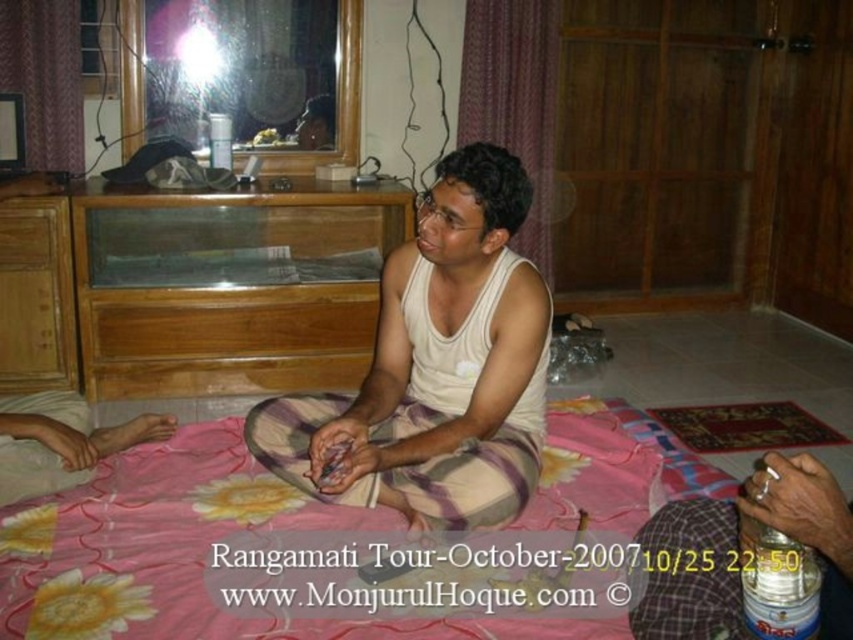
Can you confirm if pink floral blanket at center is shorter than white cotton tank top at center?

Yes.

Can you confirm if pink floral blanket at center is bigger than white cotton tank top at center?

Indeed, pink floral blanket at center has a larger size compared to white cotton tank top at center.

Does point (566, 572) come farther from viewer compared to point (367, 416)?

No, (566, 572) is in front of (367, 416).

The height and width of the screenshot is (640, 853). I want to click on pink floral blanket at center, so click(x=322, y=548).